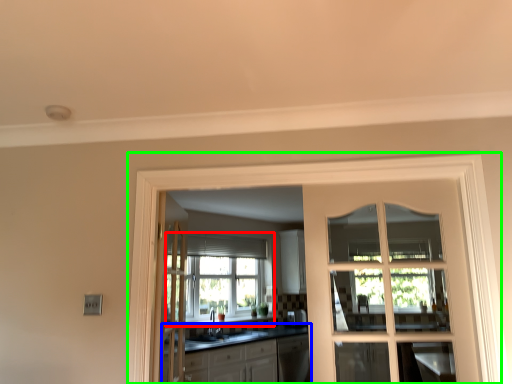
Question: Which object is positioned farthest from window (highlighted by a red box)? Select from cabinetry (highlighted by a blue box) and window frame (highlighted by a green box).

Choices:
 (A) cabinetry
 (B) window frame

Answer: (B)